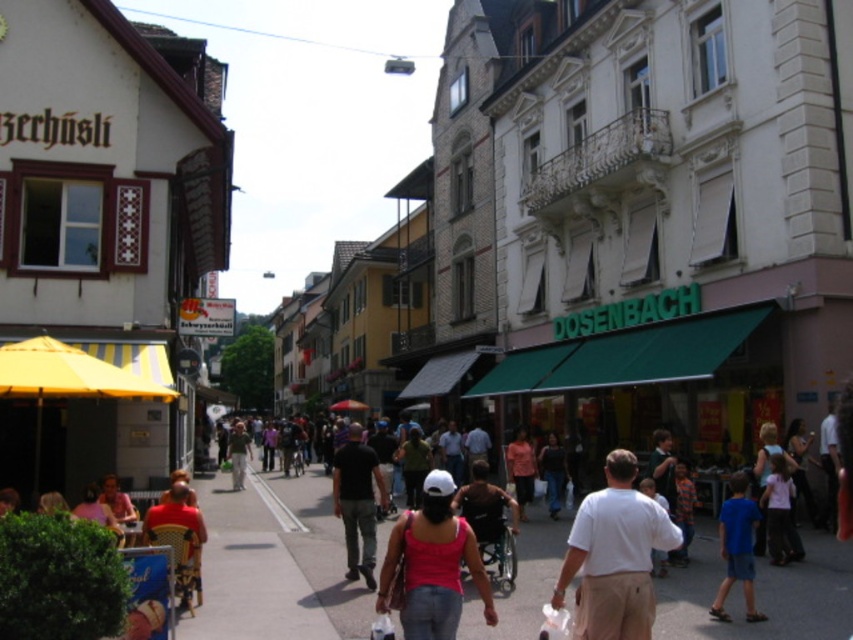
You are standing on the street in the European town scene. There is a point marked at coordinates [625,355]. Which object does this point correspond to?

The point corresponds to the green fabric awning at center.

You are standing on the street and want to take a photo that includes both the point at coordinates (498, 364) and the point at (747, 554). Based on their positions, which point should be closer to the camera in your photo?

Point at coordinates (498, 364) should be closer to the camera in the photo because it is further to the camera than point at coordinates (747, 554).

You are a street performer with a 1.5 meter wide cart that needs to pass between the green fabric awning at center and the blue cotton shirt at lower right. Can your cart fit through the space between them?

The green fabric awning at center is wider than the blue cotton shirt at lower right. However, the description does not specify the distance between them, so we cannot determine if the 1.5 meter wide cart can fit through the space between them.